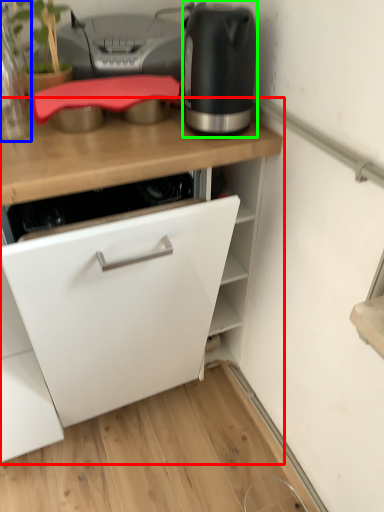
Question: Considering the real-world distances, which object is closest to cabinetry (highlighted by a red box)? kitchen appliance (highlighted by a blue box) or home appliance (highlighted by a green box).

Choices:
 (A) kitchen appliance
 (B) home appliance

Answer: (B)